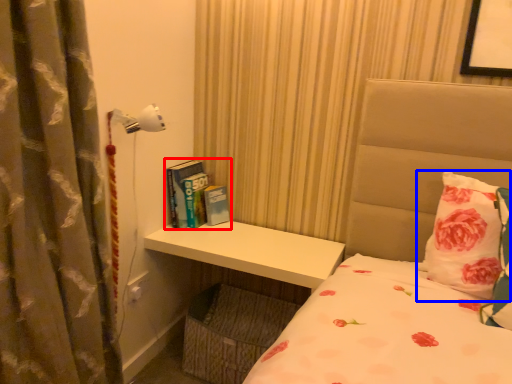
Question: Which object is closer to the camera taking this photo, book (highlighted by a red box) or pillow (highlighted by a blue box)?

Choices:
 (A) book
 (B) pillow

Answer: (B)